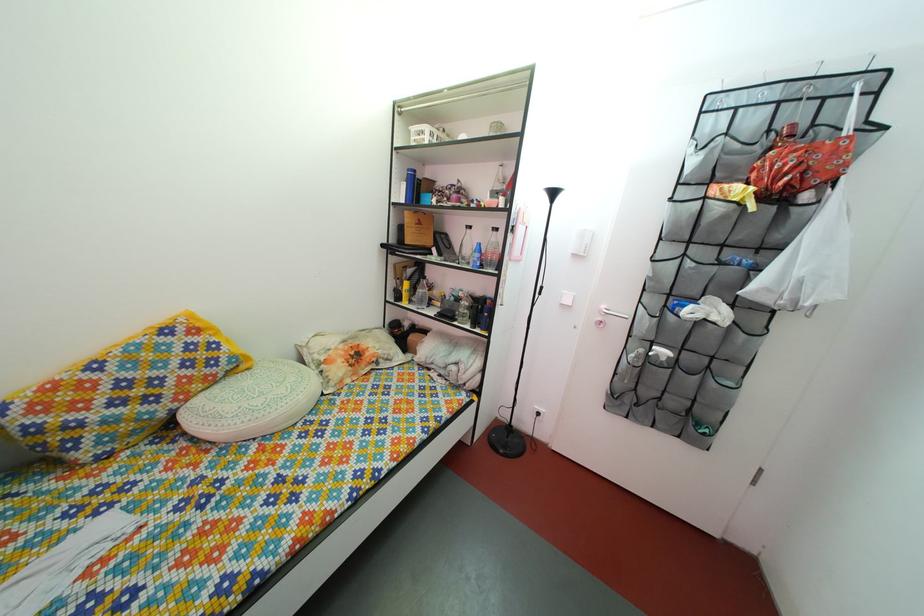
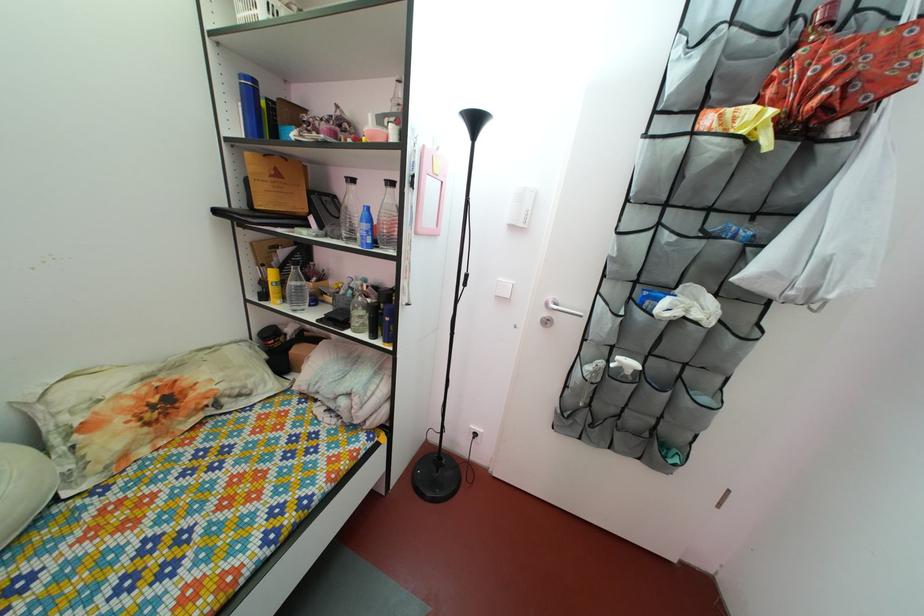
Where in the second image is the point corresponding to the point at 492,261 from the first image?

(383, 230)